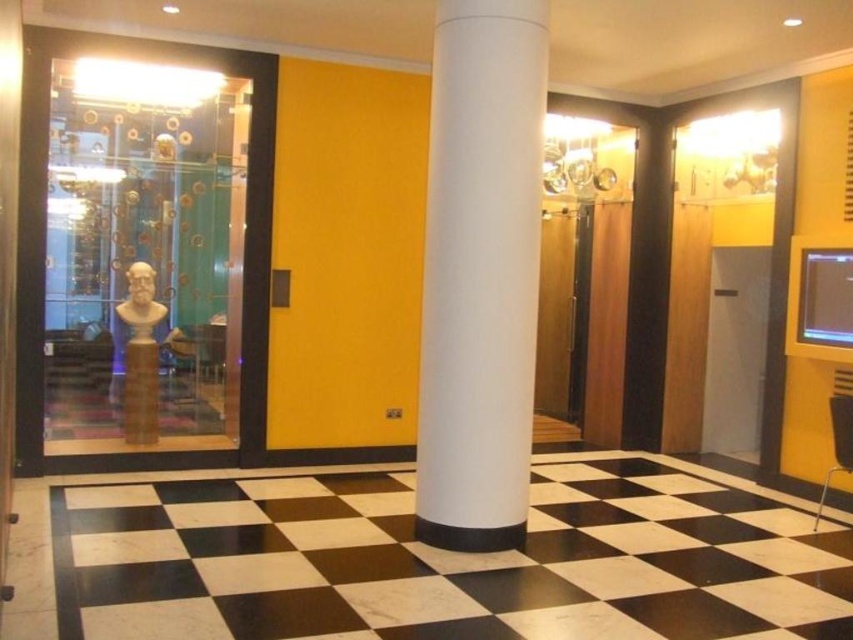
Question: Does white smooth column at center have a lesser width compared to satin gold bust at left?

Choices:
 (A) yes
 (B) no

Answer: (B)

Question: Estimate the real-world distances between objects in this image. Which object is farther from the matte gold bust at left?

Choices:
 (A) white smooth column at center
 (B) transparent glass bust at left
 (C) satin gold bust at left

Answer: (A)

Question: Which point appears farthest from the camera in this image?

Choices:
 (A) (149, 417)
 (B) (132, 276)
 (C) (531, 33)
 (D) (62, 328)

Answer: (A)

Question: Can you confirm if satin gold bust at left is positioned above matte gold bust at left?

Choices:
 (A) no
 (B) yes

Answer: (A)

Question: Which object is positioned farthest from the transparent glass bust at left?

Choices:
 (A) satin gold bust at left
 (B) matte gold bust at left

Answer: (A)

Question: Is transparent glass bust at left positioned at the back of satin gold bust at left?

Choices:
 (A) no
 (B) yes

Answer: (A)